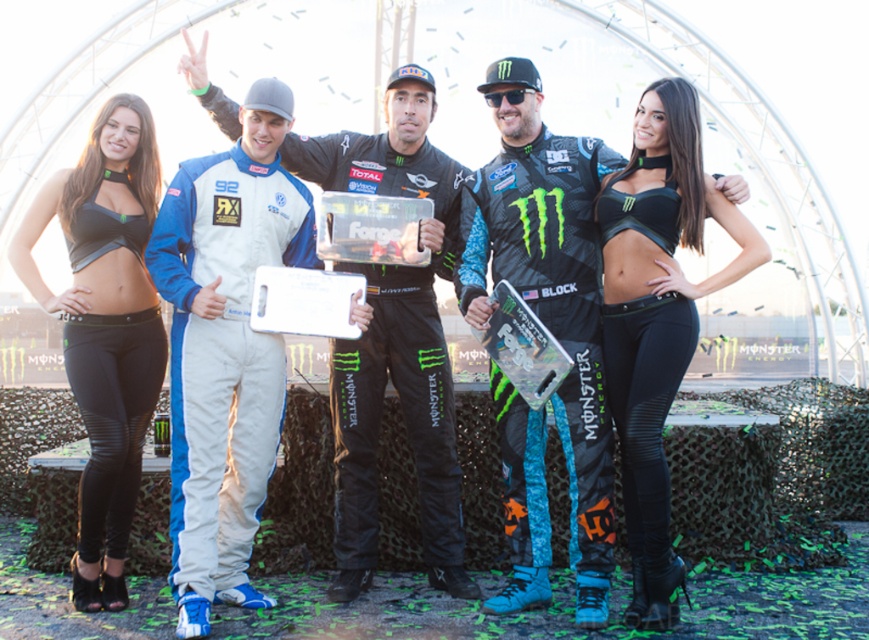
Who is more distant from viewer, (55, 304) or (677, 170)?

The point (677, 170) is more distant.

Does point (144, 163) come in front of point (693, 289)?

No.

The width and height of the screenshot is (869, 640). In order to click on matte black sports bra at left in this screenshot , I will do `click(105, 326)`.

Is white fabric racing suit at center further to the viewer compared to matte black sports bra at left?

No, white fabric racing suit at center is in front of matte black sports bra at left.

Based on the photo, does white fabric racing suit at center have a smaller size compared to matte black sports bra at left?

Incorrect, white fabric racing suit at center is not smaller in size than matte black sports bra at left.

Who is more distant from viewer, (180,307) or (52,193)?

Positioned behind is point (52,193).

Image resolution: width=869 pixels, height=640 pixels. I want to click on white fabric racing suit at center, so click(224, 348).

Can you confirm if white fabric racing suit at center is positioned to the left of black mesh racing suit at center?

Yes, white fabric racing suit at center is to the left of black mesh racing suit at center.

Between white fabric racing suit at center and black mesh racing suit at center, which one appears on the right side from the viewer's perspective?

From the viewer's perspective, black mesh racing suit at center appears more on the right side.

Image resolution: width=869 pixels, height=640 pixels. Identify the location of white fabric racing suit at center. (224, 348).